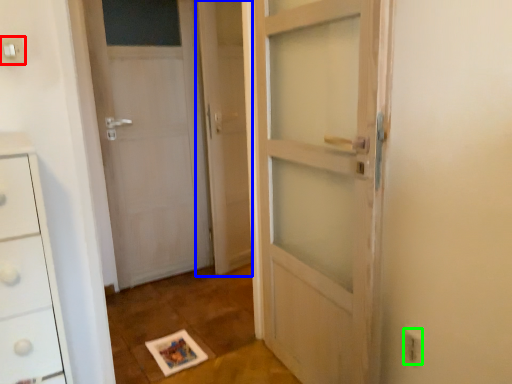
Question: Estimate the real-world distances between objects in this image. Which object is farther from electric outlet (highlighted by a red box), screen door (highlighted by a blue box) or electric outlet (highlighted by a green box)?

Choices:
 (A) screen door
 (B) electric outlet

Answer: (A)